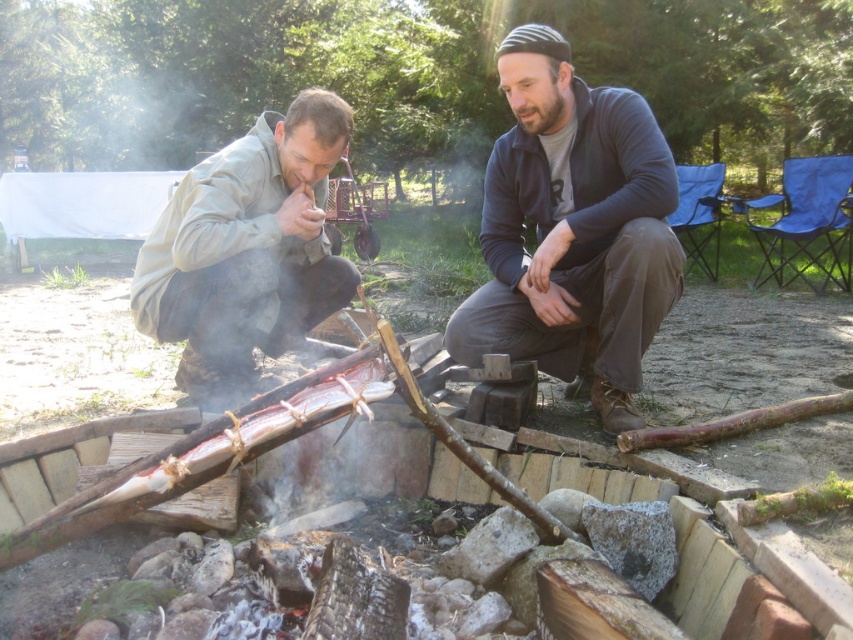
You are planning to pack a jacket for a chilly evening by the campfire. You have both the dark blue sweater at center and the matte khaki jacket at left. Which one would you choose based on their sizes?

The dark blue sweater at center is bigger than the matte khaki jacket at left, so you should choose the dark blue sweater at center for a chillier evening as it provides more warmth due to its larger size.

You are standing at the viewer position and want to pick up the dark blue sweater at center. Is the sweater within your immediate reach without moving your feet?

The dark blue sweater at center and viewer are 2.34 meters apart from each other, so the sweater is too far to reach without moving your feet.